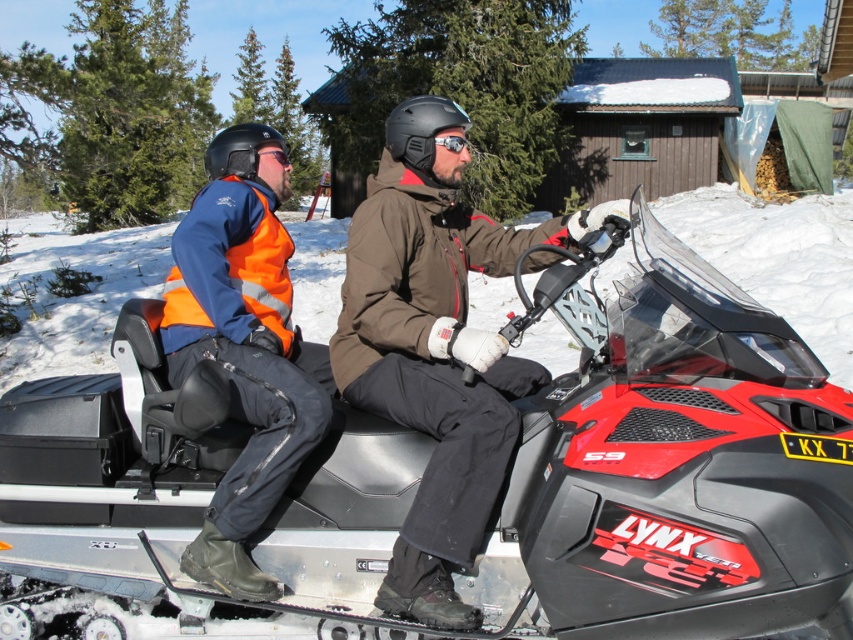
Question: Among these points, which one is nearest to the camera?

Choices:
 (A) (157, 572)
 (B) (242, 289)
 (C) (190, 337)
 (D) (445, 145)

Answer: (A)

Question: Does red plastic snowmobile at center have a lesser width compared to transparent plastic goggles at center?

Choices:
 (A) no
 (B) yes

Answer: (A)

Question: Estimate the real-world distances between objects in this image. Which object is farther from the transparent plastic goggles at center?

Choices:
 (A) high visibility orange jacket at left
 (B) matte black snowmobile at center

Answer: (A)

Question: Does matte black snowmobile at center have a greater width compared to high visibility orange jacket at left?

Choices:
 (A) no
 (B) yes

Answer: (B)

Question: Does red plastic snowmobile at center appear on the left side of high visibility orange jacket at left?

Choices:
 (A) yes
 (B) no

Answer: (B)

Question: Considering the real-world distances, which object is closest to the matte black goggles at upper center?

Choices:
 (A) high visibility orange jacket at left
 (B) matte black snowmobile at center
 (C) red plastic snowmobile at center

Answer: (A)